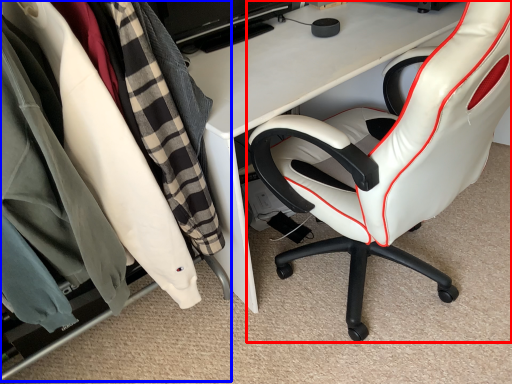
Question: Which object appears closest to the camera in this image, chair (highlighted by a red box) or closet (highlighted by a blue box)?

Choices:
 (A) chair
 (B) closet

Answer: (A)